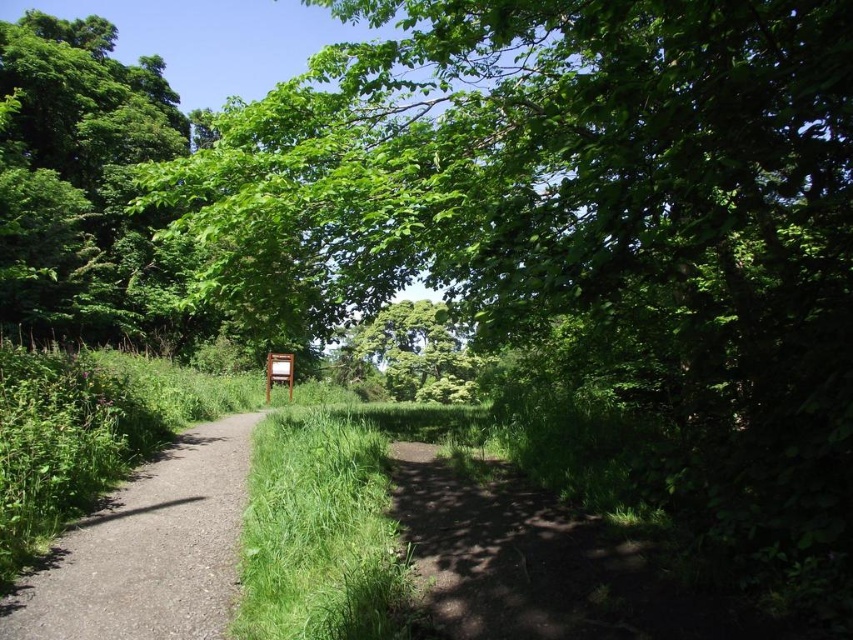
You are a hiker walking along the dirt path at center and want to rest under the green leafy tree at upper left. Can you reach the tree by staying on the path?

The green leafy tree at upper left is positioned over the dirt path at center, so yes, you can reach the tree by staying on the path as it is directly above the path.

You are standing at point [76,177] in the image. What object is located exactly at this point?

At point [76,177] lies green leafy tree at upper left.

You are planning to take a photo of the green leafy tree at upper left and the green grass at center. Which object should you focus on first if you want to capture both in one shot without moving the camera?

The green leafy tree at upper left is larger in size than the green grass at center, so you should focus on the green leafy tree at upper left first to ensure it fills the frame appropriately before adjusting for the smaller green grass at center.